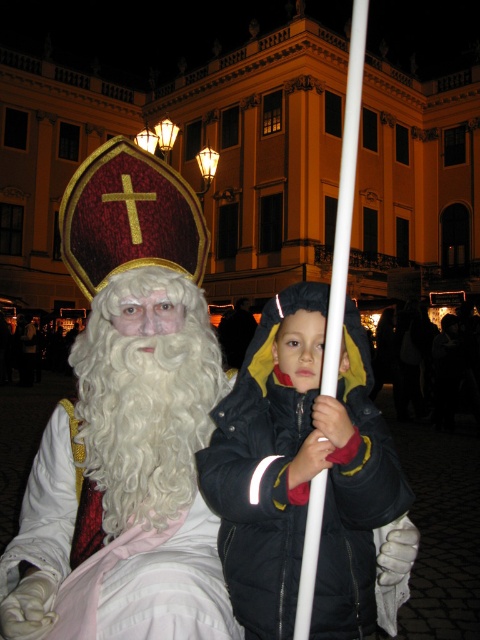
Question: Which of the following is the farthest from the observer?

Choices:
 (A) (120, 451)
 (B) (301, 291)

Answer: (B)

Question: Which point is closer to the camera?

Choices:
 (A) (173, 404)
 (B) (107, 314)
 (C) (372, 596)
 (D) (346, 220)

Answer: (D)

Question: Is black puffy coat at center below white curly beard at center?

Choices:
 (A) no
 (B) yes

Answer: (B)

Question: Does black puffy coat at center appear over white plastic pole at center?

Choices:
 (A) no
 (B) yes

Answer: (A)

Question: Observing the image, what is the correct spatial positioning of white curly beard at center in reference to white plastic pole at center?

Choices:
 (A) above
 (B) below

Answer: (B)

Question: Which of these objects is positioned farthest from the white plastic pole at center?

Choices:
 (A) black puffy coat at center
 (B) white curly beard at center
 (C) velvet gold hat at center

Answer: (C)